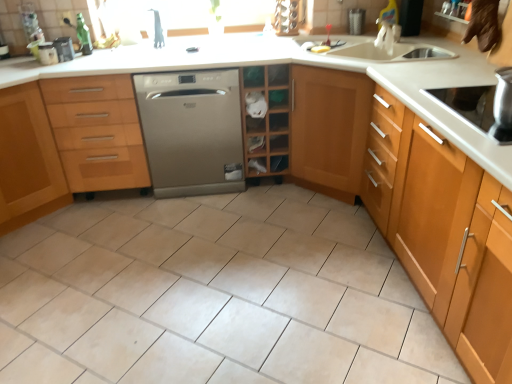
Question: From the image's perspective, is wooden shelf at center over light brown wood cabinet at right, marked as the 1th cabinetry in a right-to-left arrangement?

Choices:
 (A) no
 (B) yes

Answer: (B)

Question: Is wooden shelf at center at the left side of light brown wood cabinet at right, marked as the 1th cabinetry in a right-to-left arrangement?

Choices:
 (A) no
 (B) yes

Answer: (B)

Question: From the image's perspective, is wooden shelf at center beneath light brown wood cabinet at right, acting as the third cabinetry starting from the left?

Choices:
 (A) yes
 (B) no

Answer: (B)

Question: Does wooden shelf at center come in front of light brown wood cabinet at right, marked as the 1th cabinetry in a right-to-left arrangement?

Choices:
 (A) yes
 (B) no

Answer: (B)

Question: Is wooden shelf at center surrounding light brown wood cabinet at right, acting as the third cabinetry starting from the left?

Choices:
 (A) yes
 (B) no

Answer: (B)

Question: Is point (467, 226) positioned closer to the camera than point (27, 109)?

Choices:
 (A) farther
 (B) closer

Answer: (B)

Question: In terms of size, does light brown wood cabinet at right, acting as the third cabinetry starting from the left, appear bigger or smaller than light brown wood cabinet at left, marked as the first cabinetry in a left-to-right arrangement?

Choices:
 (A) big
 (B) small

Answer: (A)

Question: Is light brown wood cabinet at right, marked as the 1th cabinetry in a right-to-left arrangement, wider or thinner than light brown wood cabinet at left, marked as the third cabinetry in a right-to-left arrangement?

Choices:
 (A) wide
 (B) thin

Answer: (B)

Question: Is light brown wood cabinet at right, acting as the third cabinetry starting from the left, in front of or behind light brown wood cabinet at left, marked as the third cabinetry in a right-to-left arrangement, in the image?

Choices:
 (A) front
 (B) behind

Answer: (A)

Question: Based on their sizes in the image, would you say black plastic container at upper left is bigger or smaller than wooden cabinet at left, marked as the second cabinetry in a left-to-right arrangement?

Choices:
 (A) small
 (B) big

Answer: (A)

Question: In terms of height, does black plastic container at upper left look taller or shorter compared to wooden cabinet at left, marked as the 2th cabinetry in a right-to-left arrangement?

Choices:
 (A) short
 (B) tall

Answer: (A)

Question: Considering their positions, is black plastic container at upper left located in front of or behind wooden cabinet at left, marked as the second cabinetry in a left-to-right arrangement?

Choices:
 (A) front
 (B) behind

Answer: (B)

Question: Based on their positions, is black plastic container at upper left located to the left or right of wooden cabinet at left, marked as the second cabinetry in a left-to-right arrangement?

Choices:
 (A) left
 (B) right

Answer: (A)

Question: Looking at their shapes, would you say black plastic container at upper left is wider or thinner than stainless steel cooktop at right?

Choices:
 (A) thin
 (B) wide

Answer: (A)

Question: Is black plastic container at upper left in front of or behind stainless steel cooktop at right in the image?

Choices:
 (A) behind
 (B) front

Answer: (A)